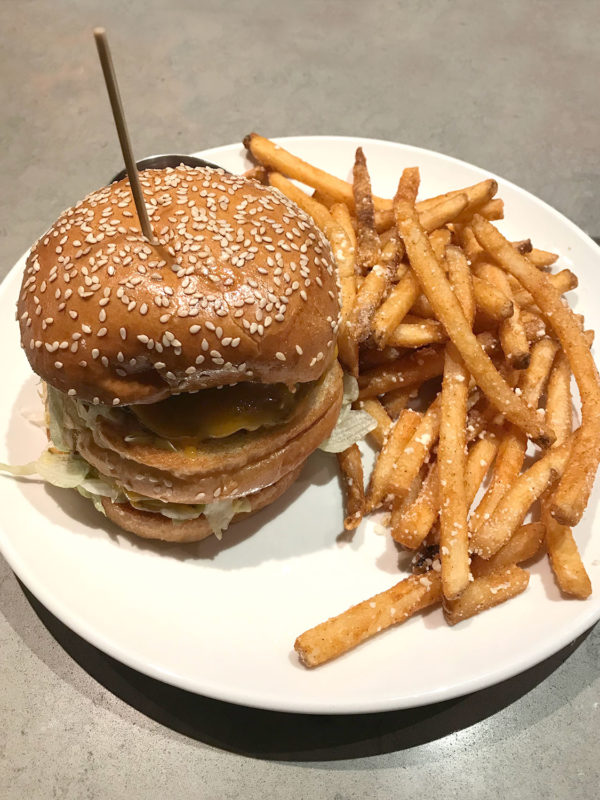
This screenshot has width=600, height=800. Identify the location of small metal dish. (168, 158).